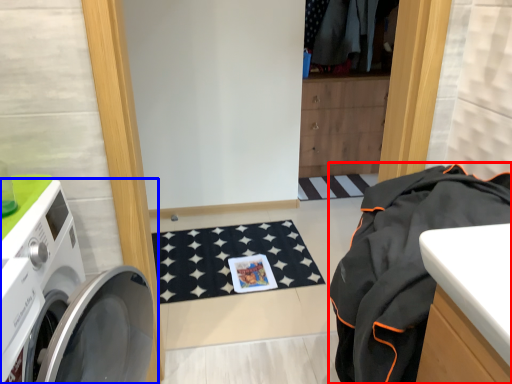
Question: Which object appears farthest to the camera in this image, clothing (highlighted by a red box) or washing machine (highlighted by a blue box)?

Choices:
 (A) clothing
 (B) washing machine

Answer: (A)